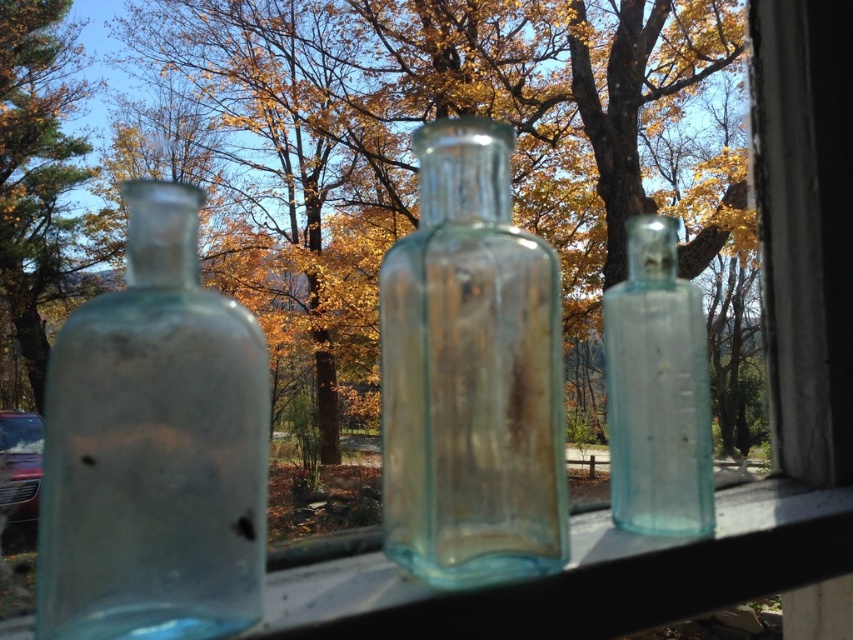
You are an interior designer assessing the placement of the transparent glass bottle at right and the green leafy tree at left in this autumn scene. Based on their sizes, which object would appear closer to the viewer?

The transparent glass bottle at right appears closer to the viewer because it is shorter than the green leafy tree at left, which is taller and likely further away.

You are standing in front of the window with three vintage glass bottles on the sill. You notice a point marked at coordinates (154, 448). Which object does this point belong to?

The point at (154, 448) is on the transparent glass bottle at left.